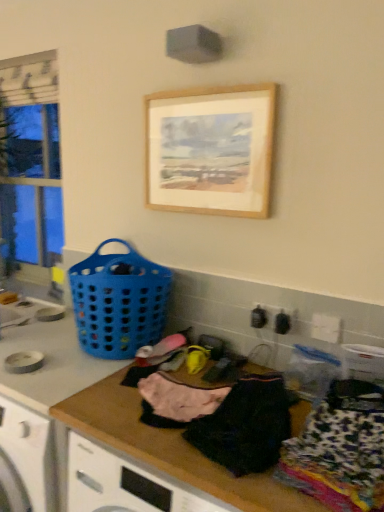
The width and height of the screenshot is (384, 512). I want to click on free space in front of blue plastic basket at left, so click(75, 374).